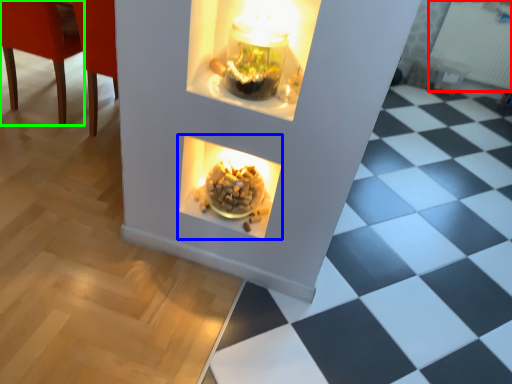
Question: Which object is the closest to the radiator (highlighted by a red box)? Choose among these: fireplace (highlighted by a blue box) or chair (highlighted by a green box).

Choices:
 (A) fireplace
 (B) chair

Answer: (A)